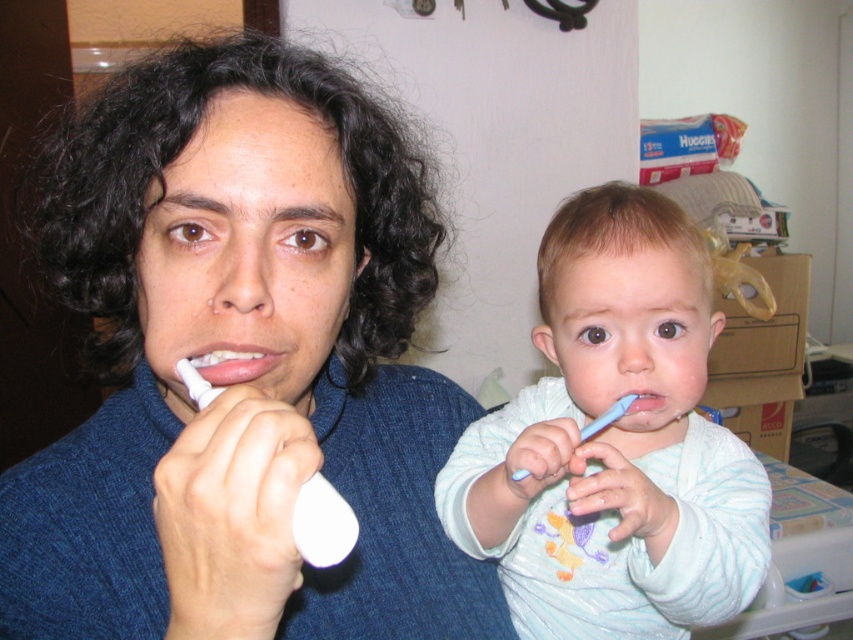
From the picture: Between matte blue sweater at center and blue plastic toothbrush at center, which one appears on the left side from the viewer's perspective?

matte blue sweater at center

Which is more to the right, matte blue sweater at center or blue plastic toothbrush at center?

blue plastic toothbrush at center

Is point (36, 518) positioned before point (621, 412)?

That is True.

Locate an element on the screen. This screenshot has width=853, height=640. matte blue sweater at center is located at coordinates (244, 381).

Does white soft toothbrush at right appear under matte white toothbrush at center?

Indeed, white soft toothbrush at right is positioned under matte white toothbrush at center.

Is white soft toothbrush at right shorter than matte white toothbrush at center?

Incorrect, white soft toothbrush at right's height does not fall short of matte white toothbrush at center's.

What do you see at coordinates (614, 442) in the screenshot?
I see `white soft toothbrush at right` at bounding box center [614, 442].

In order to click on white soft toothbrush at right in this screenshot , I will do `click(614, 442)`.

Between matte blue sweater at center and white soft toothbrush at right, which one is positioned higher?

matte blue sweater at center

Locate an element on the screen. matte blue sweater at center is located at coordinates (244, 381).